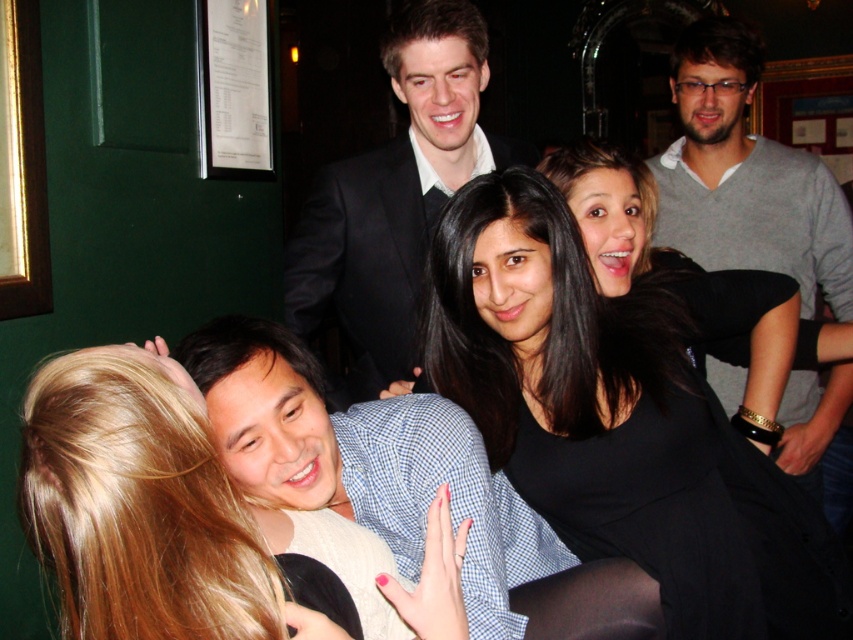
Is black matte dress at center behind black suit at center?

No, black matte dress at center is closer to the viewer.

Image resolution: width=853 pixels, height=640 pixels. I want to click on black matte dress at center, so click(x=621, y=416).

Is black suit at center in front of gray sweater at upper right?

That is True.

Can you confirm if black suit at center is thinner than gray sweater at upper right?

No, black suit at center is not thinner than gray sweater at upper right.

Is point (314, 237) farther from viewer compared to point (753, 248)?

No, (314, 237) is in front of (753, 248).

The height and width of the screenshot is (640, 853). In order to click on black suit at center in this screenshot , I will do `click(395, 195)`.

Between point (650, 442) and point (798, 436), which one is positioned in front?

Point (650, 442) is more forward.

Is black matte dress at center thinner than gray sweater at upper right?

Incorrect, black matte dress at center's width is not less than gray sweater at upper right's.

Which is in front, point (666, 618) or point (680, 65)?

Point (666, 618)

This screenshot has height=640, width=853. Find the location of `black matte dress at center`. black matte dress at center is located at coordinates (621, 416).